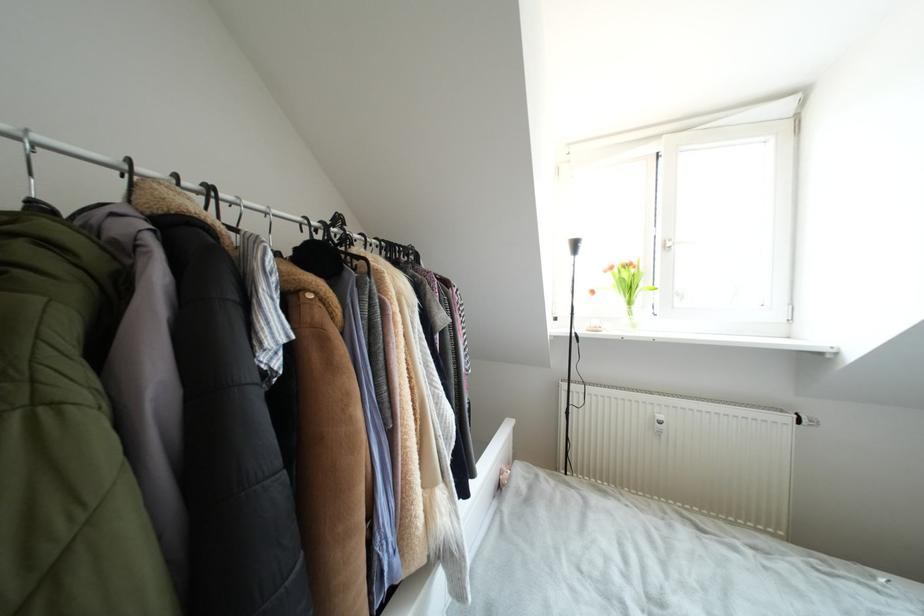
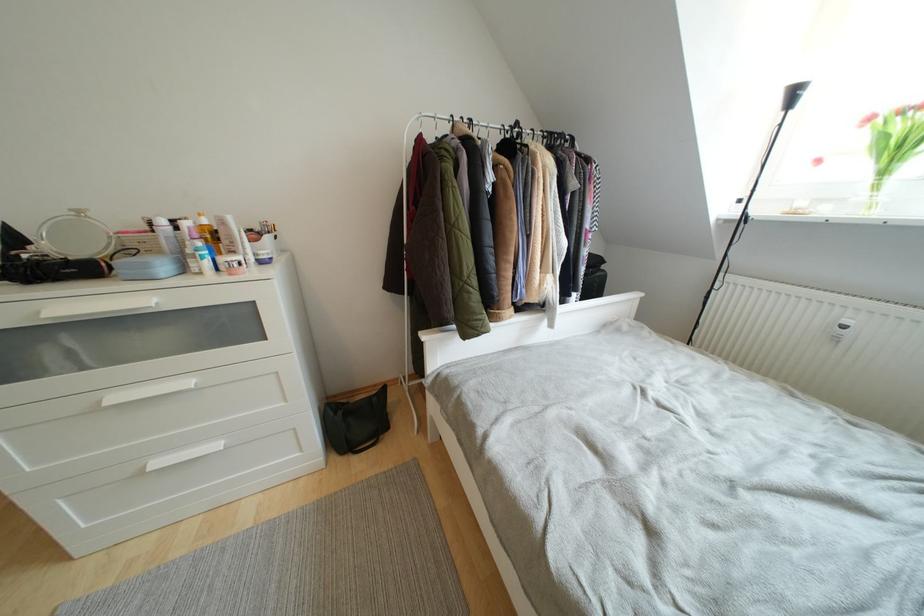
In the second image, find the point that corresponds to (x=664, y=421) in the first image.

(853, 326)